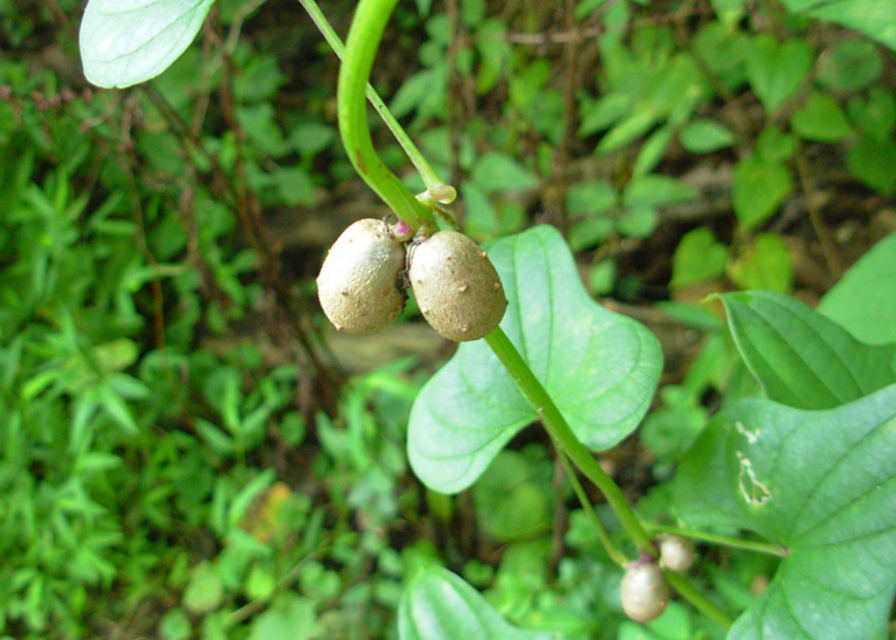
Question: Which object is positioned closest to the smooth beige pod at center?

Choices:
 (A) smooth brown seed at center
 (B) smooth beige fruit at center

Answer: (A)

Question: Considering the real-world distances, which object is farthest from the smooth beige fruit at center?

Choices:
 (A) smooth beige pod at center
 (B) smooth brown seed at center

Answer: (A)

Question: Is smooth beige pod at center closer to the viewer compared to smooth beige fruit at center?

Choices:
 (A) no
 (B) yes

Answer: (B)

Question: Which object appears farthest from the camera in this image?

Choices:
 (A) smooth brown seed at center
 (B) smooth beige fruit at center
 (C) smooth beige pod at center

Answer: (B)

Question: Is smooth beige pod at center thinner than smooth brown seed at center?

Choices:
 (A) no
 (B) yes

Answer: (B)

Question: Considering the relative positions of smooth brown seed at center and smooth beige fruit at center in the image provided, where is smooth brown seed at center located with respect to smooth beige fruit at center?

Choices:
 (A) left
 (B) right

Answer: (A)